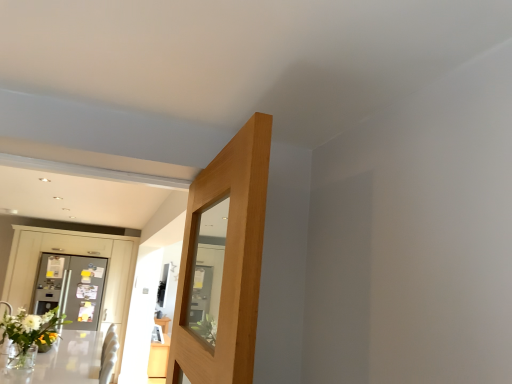
This screenshot has height=384, width=512. What do you see at coordinates (71, 288) in the screenshot?
I see `metallic silver refrigerator at left` at bounding box center [71, 288].

Identify the location of metallic silver refrigerator at left. Image resolution: width=512 pixels, height=384 pixels. (71, 288).

Locate an element on the screen. light wood table at lower left, which appears as the second table when viewed from the top is located at coordinates (159, 358).

What do you see at coordinates (159, 358) in the screenshot? I see `light wood table at lower left, which appears as the first table when ordered from the bottom` at bounding box center [159, 358].

What is the approximate width of clear glass table at lower left, marked as the second table in a back-to-front arrangement?

It is 3.66 feet.

This screenshot has width=512, height=384. Find the location of `metallic silver refrigerator at left`. metallic silver refrigerator at left is located at coordinates (71, 288).

From a real-world perspective, relative to clear glass table at lower left, placed as the second table when sorted from bottom to top, is light wood table at lower left, the first table in the back-to-front sequence, vertically above or below?

Clearly, from a real-world perspective, light wood table at lower left, the first table in the back-to-front sequence, is below clear glass table at lower left, placed as the second table when sorted from bottom to top.

Is clear glass table at lower left, marked as the second table in a back-to-front arrangement, at the back of light wood table at lower left, which appears as the second table when viewed from the top?

light wood table at lower left, which appears as the second table when viewed from the top, does not have its back to clear glass table at lower left, marked as the second table in a back-to-front arrangement.

Is light wood table at lower left, which appears as the first table when ordered from the bottom, located outside clear glass table at lower left, which is the 1th table in top-to-bottom order?

Absolutely, light wood table at lower left, which appears as the first table when ordered from the bottom, is external to clear glass table at lower left, which is the 1th table in top-to-bottom order.

Could you measure the distance between light wood table at lower left, which is the second table from front to back, and clear glass table at lower left, the first table from the front?

light wood table at lower left, which is the second table from front to back, and clear glass table at lower left, the first table from the front, are 28.19 inches apart.

Can you confirm if metallic silver refrigerator at left is thinner than light wood table at lower left, the first table in the back-to-front sequence?

Indeed, metallic silver refrigerator at left has a lesser width compared to light wood table at lower left, the first table in the back-to-front sequence.

Which point is more distant from viewer, (x=37, y=280) or (x=152, y=358)?

The point (x=37, y=280) is more distant.

Consider the image. Could you tell me if metallic silver refrigerator at left is facing light wood table at lower left, which is the second table from front to back?

No, metallic silver refrigerator at left is not turned towards light wood table at lower left, which is the second table from front to back.

Which is more to the right, metallic silver refrigerator at left or light wood table at lower left, which appears as the first table when ordered from the bottom?

Positioned to the right is light wood table at lower left, which appears as the first table when ordered from the bottom.

Which is in front, point (25, 303) or point (84, 309)?

The point (25, 303) is closer.

Is the position of metallic gray dresser at left less distant than that of metallic silver refrigerator at left?

Yes, metallic gray dresser at left is closer to the viewer.

How many degrees apart are the facing directions of metallic gray dresser at left and metallic silver refrigerator at left?

There is a 2.42-degree angle between the facing directions of metallic gray dresser at left and metallic silver refrigerator at left.

In the scene shown: Is metallic gray dresser at left to the left or to the right of metallic silver refrigerator at left in the image?

Clearly, metallic gray dresser at left is on the left of metallic silver refrigerator at left in the image.

Is point (63, 287) farther from viewer compared to point (20, 251)?

Yes, it is.

Considering the sizes of objects metallic silver refrigerator at left and metallic gray dresser at left in the image provided, who is shorter, metallic silver refrigerator at left or metallic gray dresser at left?

metallic silver refrigerator at left is shorter.

Considering the relative sizes of metallic silver refrigerator at left and metallic gray dresser at left in the image provided, is metallic silver refrigerator at left smaller than metallic gray dresser at left?

Correct, metallic silver refrigerator at left occupies less space than metallic gray dresser at left.

Relative to metallic gray dresser at left, is metallic silver refrigerator at left in front or behind?

Clearly, metallic silver refrigerator at left is behind metallic gray dresser at left.

How different are the orientations of light wood table at lower left, which appears as the first table when ordered from the bottom, and metallic gray dresser at left in degrees?

The facing directions of light wood table at lower left, which appears as the first table when ordered from the bottom, and metallic gray dresser at left are 93.1 degrees apart.

Is light wood table at lower left, which appears as the first table when ordered from the bottom, at the right side of metallic gray dresser at left?

Correct, you'll find light wood table at lower left, which appears as the first table when ordered from the bottom, to the right of metallic gray dresser at left.

From the image's perspective, is light wood table at lower left, which appears as the second table when viewed from the top, above or below metallic gray dresser at left?

Clearly, from the image's perspective, light wood table at lower left, which appears as the second table when viewed from the top, is below metallic gray dresser at left.

Who is shorter, light wood table at lower left, which is the second table from front to back, or metallic gray dresser at left?

light wood table at lower left, which is the second table from front to back, is shorter.

Can you confirm if light wood table at lower left, the first table in the back-to-front sequence, is smaller than metallic silver refrigerator at left?

Yes, light wood table at lower left, the first table in the back-to-front sequence, is smaller than metallic silver refrigerator at left.

Which object is positioned more to the left, light wood table at lower left, which appears as the second table when viewed from the top, or metallic silver refrigerator at left?

metallic silver refrigerator at left.

Considering the sizes of objects metallic gray dresser at left and clear glass table at lower left, marked as the second table in a back-to-front arrangement, in the image provided, who is thinner, metallic gray dresser at left or clear glass table at lower left, marked as the second table in a back-to-front arrangement,?

metallic gray dresser at left.

Is metallic gray dresser at left smaller than clear glass table at lower left, marked as the second table in a back-to-front arrangement?

Actually, metallic gray dresser at left might be larger than clear glass table at lower left, marked as the second table in a back-to-front arrangement.

Is metallic gray dresser at left facing towards clear glass table at lower left, marked as the second table in a back-to-front arrangement?

Yes.

Locate an element on the screen. This screenshot has width=512, height=384. the 1st table located beneath the metallic gray dresser at left (from a real-world perspective) is located at coordinates (62, 361).

Locate an element on the screen. The width and height of the screenshot is (512, 384). table below the clear glass table at lower left, the first table from the front (from a real-world perspective) is located at coordinates (159, 358).

In order to click on screen door above the light wood table at lower left, which appears as the first table when ordered from the bottom (from a real-world perspective) in this screenshot , I will do `click(71, 288)`.

From the image, which object appears to be nearer to metallic silver refrigerator at left, light wood table at lower left, which appears as the first table when ordered from the bottom, or metallic gray dresser at left?

The object closer to metallic silver refrigerator at left is metallic gray dresser at left.

Which object lies nearer to the anchor point light wood table at lower left, which appears as the first table when ordered from the bottom, metallic gray dresser at left or metallic silver refrigerator at left?

metallic gray dresser at left lies closer to light wood table at lower left, which appears as the first table when ordered from the bottom, than the other object.

Which object lies further to the anchor point clear glass table at lower left, marked as the second table in a back-to-front arrangement, metallic gray dresser at left or light wood table at lower left, the first table in the back-to-front sequence?

metallic gray dresser at left is further to clear glass table at lower left, marked as the second table in a back-to-front arrangement.

Which object lies nearer to the anchor point light wood table at lower left, the first table in the back-to-front sequence, metallic silver refrigerator at left or metallic gray dresser at left?

metallic gray dresser at left lies closer to light wood table at lower left, the first table in the back-to-front sequence, than the other object.

Looking at the image, which one is located closer to clear glass table at lower left, the first table from the front, light wood table at lower left, the first table in the back-to-front sequence, or metallic gray dresser at left?

light wood table at lower left, the first table in the back-to-front sequence, is closer to clear glass table at lower left, the first table from the front.

Looking at the image, which one is located further to metallic gray dresser at left, metallic silver refrigerator at left or light wood table at lower left, the first table in the back-to-front sequence?

light wood table at lower left, the first table in the back-to-front sequence, is further to metallic gray dresser at left.

When comparing their distances from metallic silver refrigerator at left, does light wood table at lower left, which appears as the first table when ordered from the bottom, or clear glass table at lower left, marked as the second table in a back-to-front arrangement, seem closer?

Among the two, clear glass table at lower left, marked as the second table in a back-to-front arrangement, is located nearer to metallic silver refrigerator at left.

From the image, which object appears to be farther from clear glass table at lower left, the first table from the front, metallic gray dresser at left or metallic silver refrigerator at left?

metallic gray dresser at left is positioned further to the anchor clear glass table at lower left, the first table from the front.

I want to click on dresser between clear glass table at lower left, marked as the second table in a back-to-front arrangement, and light wood table at lower left, which appears as the second table when viewed from the top, along the z-axis, so [x=74, y=254].

Locate an element on the screen. dresser between clear glass table at lower left, which is the 1th table in top-to-bottom order, and metallic silver refrigerator at left in the front-back direction is located at coordinates (74, 254).

The image size is (512, 384). I want to click on screen door between clear glass table at lower left, which is the 1th table in top-to-bottom order, and light wood table at lower left, which appears as the second table when viewed from the top, from front to back, so click(x=71, y=288).

Locate an element on the screen. screen door between metallic gray dresser at left and light wood table at lower left, which appears as the first table when ordered from the bottom, in the vertical direction is located at coordinates (71, 288).